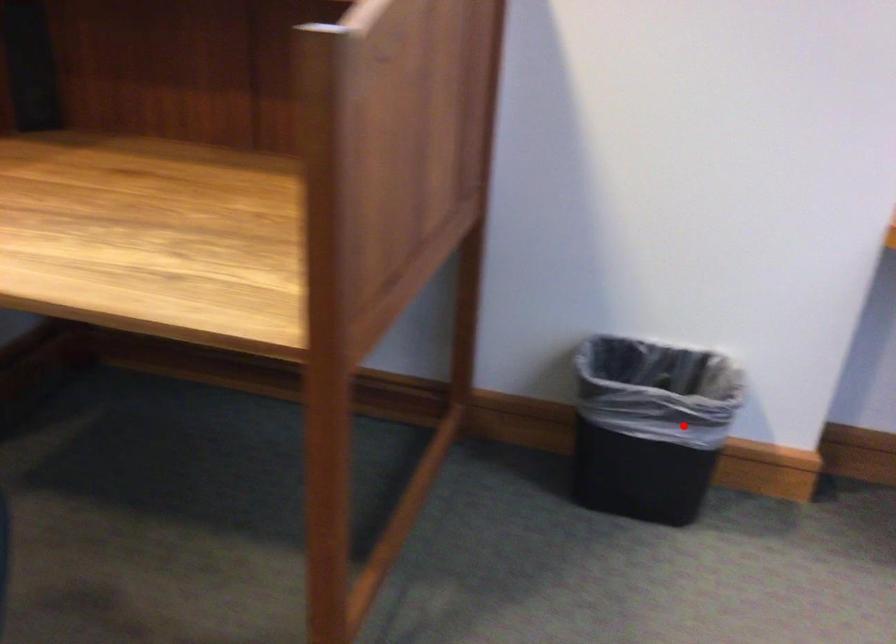
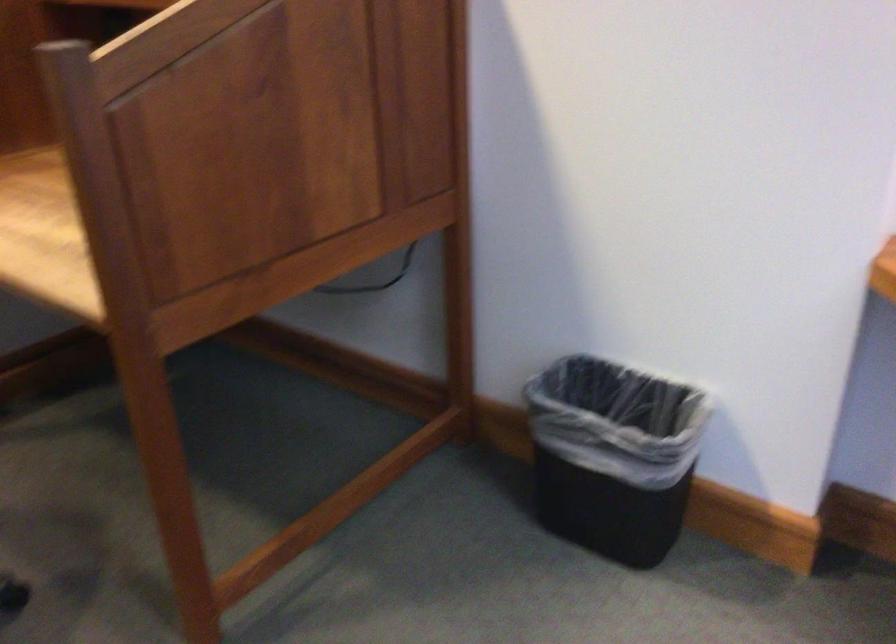
Question: I am providing you with two images of the same scene from different viewpoints. A red point is marked on the first image. Can you still see the location of the red point in image 2?

Choices:
 (A) Yes
 (B) No

Answer: (A)